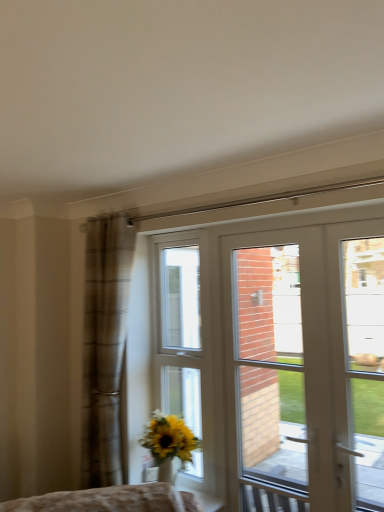
Question: Looking at their shapes, would you say white glossy door at center is wider or thinner than white glossy window at center?

Choices:
 (A) wide
 (B) thin

Answer: (A)

Question: Does point (311, 420) appear closer or farther from the camera than point (198, 321)?

Choices:
 (A) closer
 (B) farther

Answer: (A)

Question: Considering the real-world distances, which object is closest to the white glass door at right?

Choices:
 (A) white glossy window at center
 (B) white glossy door at center
 (C) brown plaid curtain at left

Answer: (B)

Question: Which object is the closest to the white glossy door at center?

Choices:
 (A) white glossy window at center
 (B) brown plaid curtain at left
 (C) white glass door at right

Answer: (C)